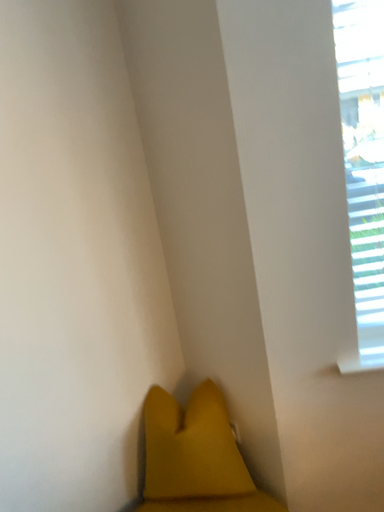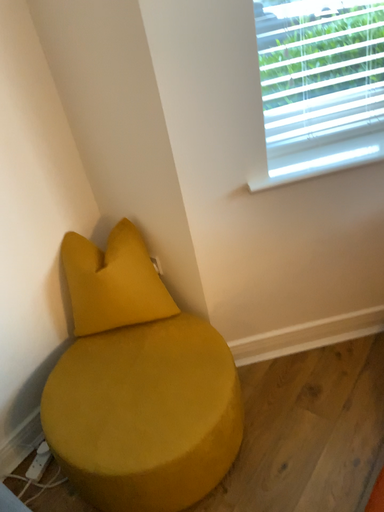
Question: Which way did the camera rotate in the video?

Choices:
 (A) rotated right
 (B) rotated left

Answer: (A)